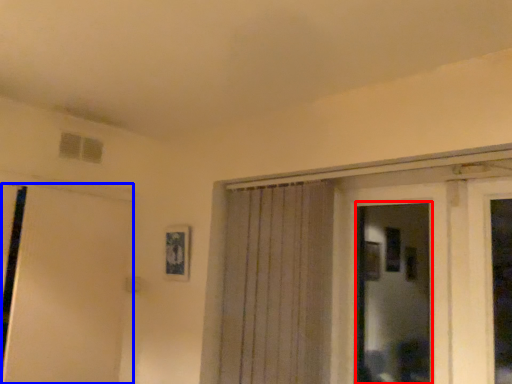
Question: Which object appears closest to the camera in this image, bay window (highlighted by a red box) or door (highlighted by a blue box)?

Choices:
 (A) bay window
 (B) door

Answer: (A)